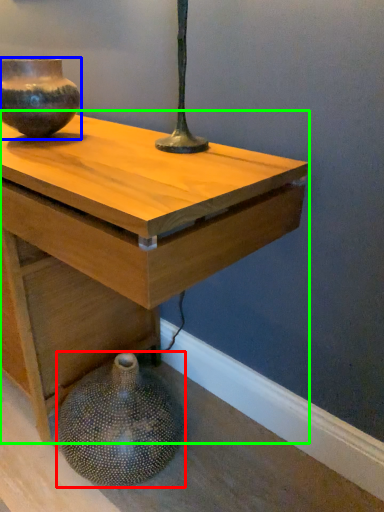
Question: Based on their relative distances, which object is nearer to vase (highlighted by a red box)? Choose from vase (highlighted by a blue box) and table (highlighted by a green box).

Choices:
 (A) vase
 (B) table

Answer: (B)